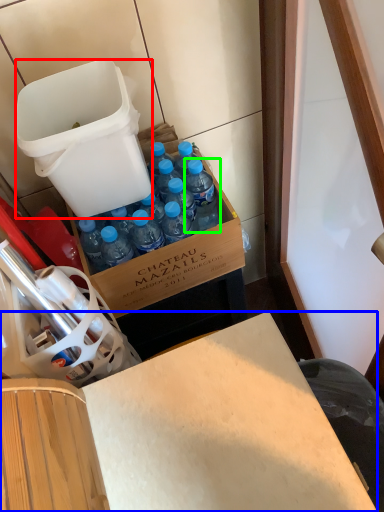
Question: Which is nearer to the trash bin/can (highlighted by a red box)? desk (highlighted by a blue box) or bottle (highlighted by a green box).

Choices:
 (A) desk
 (B) bottle

Answer: (B)